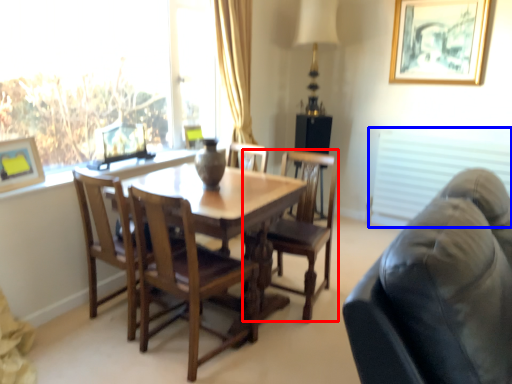
Question: Which of the following is the closest to the observer, chair (highlighted by a red box) or blind (highlighted by a blue box)?

Choices:
 (A) chair
 (B) blind

Answer: (A)